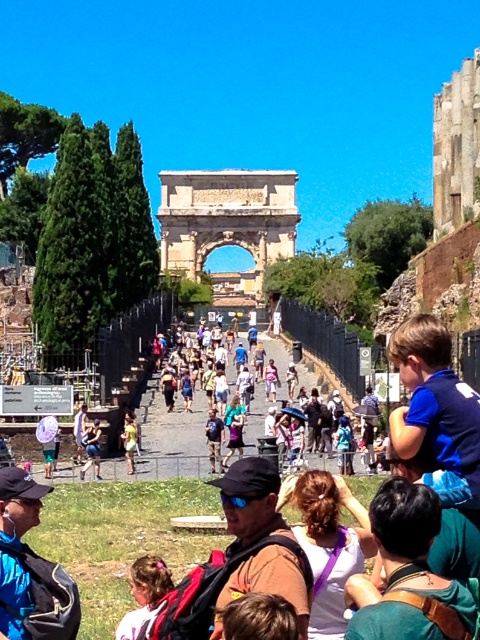
You are standing at the base of the ancient Roman arch and want to take a photo of the pink hair at lower left and green fabric shirt at lower right. The camera you have can focus on objects up to 50 feet away. Will both subjects be in focus?

The green fabric shirt at lower right is 46.11 feet away from pink hair at lower left. Since the maximum focusing distance is 50 feet, both subjects will be within the camera range and in focus.

You are a photographer trying to capture a photo of the Arch of Titus. You notice a tourist wearing a green fabric shirt at lower right and another wearing denim shorts at center. Based on their positions, which clothing item is closer to the base of the arch?

The green fabric shirt at lower right is located below denim shorts at center, so the green fabric shirt at lower right is closer to the base of the arch.